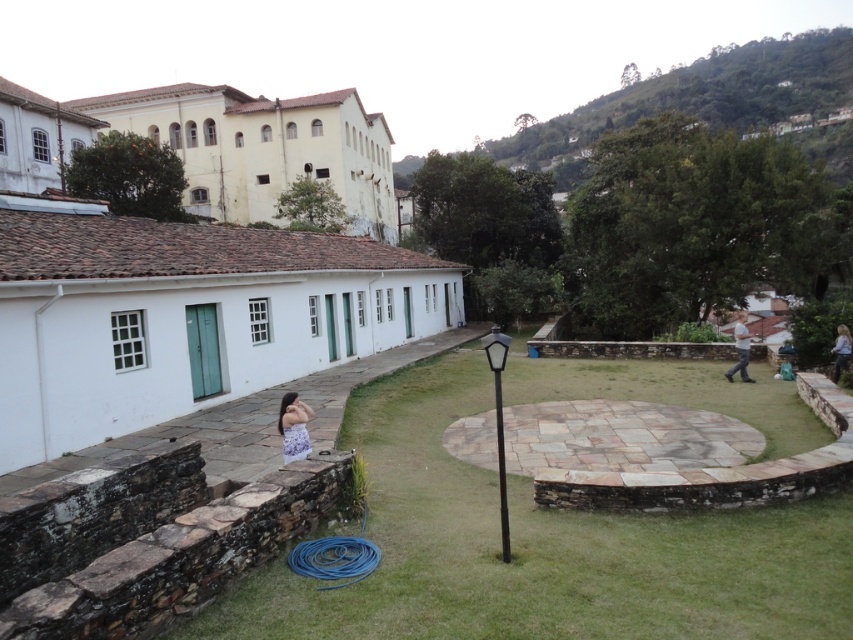
Where is `green grass at lower left`? green grass at lower left is located at coordinates [x=538, y=548].

Is point (677, 596) behind point (838, 356)?

That is False.

Locate an element on the screen. green grass at lower left is located at coordinates pos(538,548).

Find the location of a particular element. This screenshot has height=640, width=853. green grass at lower left is located at coordinates (538, 548).

Looking at this image, who is lower down, floral dress at lower center or white fabric shirt at right?

Positioned lower is floral dress at lower center.

What do you see at coordinates (293, 426) in the screenshot? I see `floral dress at lower center` at bounding box center [293, 426].

Identify the location of floral dress at lower center. (293, 426).

Identify the location of floral dress at lower center. Image resolution: width=853 pixels, height=640 pixels. (293, 426).

Is white fabric shirt at right wider than light blue denim dress at lower right?

Yes, white fabric shirt at right is wider than light blue denim dress at lower right.

Which of these two, white fabric shirt at right or light blue denim dress at lower right, stands shorter?

With less height is light blue denim dress at lower right.

You are a GUI agent. You are given a task and a screenshot of the screen. Output one action in this format:
    pyautogui.click(x=<x>, y=<y>)
    Task: Click on the white fabric shirt at right
    
    Given the screenshot: What is the action you would take?
    pyautogui.click(x=740, y=349)